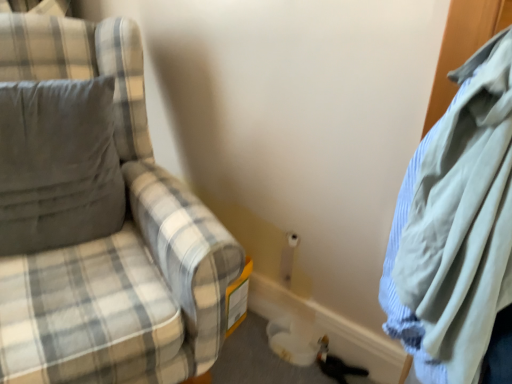
Question: Looking at the image, does light blue cotton shirt at right seem bigger or smaller compared to gray fabric pillow at left?

Choices:
 (A) small
 (B) big

Answer: (B)

Question: Is light blue cotton shirt at right to the left or to the right of gray fabric pillow at left in the image?

Choices:
 (A) left
 (B) right

Answer: (B)

Question: Which is farther from the light blue cotton shirt at right?

Choices:
 (A) gray fabric pillow at left
 (B) plaid fabric chair at left

Answer: (A)

Question: Based on their relative distances, which object is nearer to the light blue cotton shirt at right?

Choices:
 (A) plaid fabric chair at left
 (B) gray fabric pillow at left

Answer: (A)